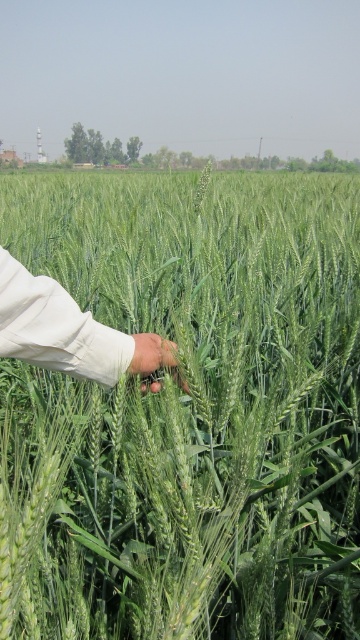
Can you confirm if green matte wheat at center is positioned above light beige fabric hand at center?

Correct, green matte wheat at center is located above light beige fabric hand at center.

Can you confirm if green matte wheat at center is positioned below light beige fabric hand at center?

Incorrect, green matte wheat at center is not positioned below light beige fabric hand at center.

Where is `green matte wheat at center`? The width and height of the screenshot is (360, 640). green matte wheat at center is located at coordinates (189, 412).

The image size is (360, 640). Find the location of `green matte wheat at center`. green matte wheat at center is located at coordinates (189, 412).